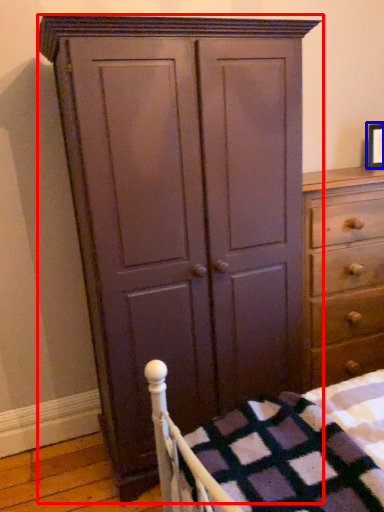
Question: Which point is further to the camera, cupboard (highlighted by a red box) or picture frame (highlighted by a blue box)?

Choices:
 (A) cupboard
 (B) picture frame

Answer: (B)